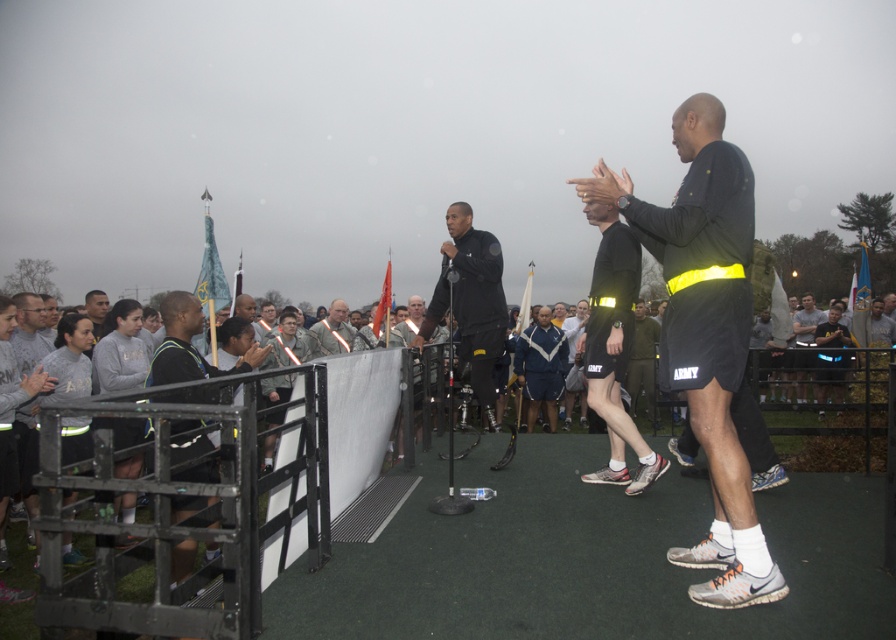
Who is positioned more to the right, matte black microphone at center or black athletic wear at left?

matte black microphone at center is more to the right.

Can you confirm if matte black microphone at center is positioned to the right of black athletic wear at left?

Indeed, matte black microphone at center is positioned on the right side of black athletic wear at left.

Which is behind, point (490, 362) or point (221, 372)?

Point (490, 362)

The image size is (896, 640). Find the location of `matte black microphone at center`. matte black microphone at center is located at coordinates (471, 301).

Who is more forward, (687,564) or (650,474)?

Point (687,564) is in front.

Is black matte shorts at center below reflective black shorts at center?

No.

Is point (683, 340) closer to viewer compared to point (593, 362)?

Yes, it is.

Find the location of `black matte shorts at center`. black matte shorts at center is located at coordinates (705, 333).

Is point (317, 353) behind point (104, 307)?

Yes, it is.

Is army uniform at center to the right of gray fabric shirt at left from the viewer's perspective?

Indeed, army uniform at center is positioned on the right side of gray fabric shirt at left.

Is point (330, 348) farther from camera compared to point (98, 301)?

Yes.

The height and width of the screenshot is (640, 896). Find the location of `army uniform at center`. army uniform at center is located at coordinates (332, 332).